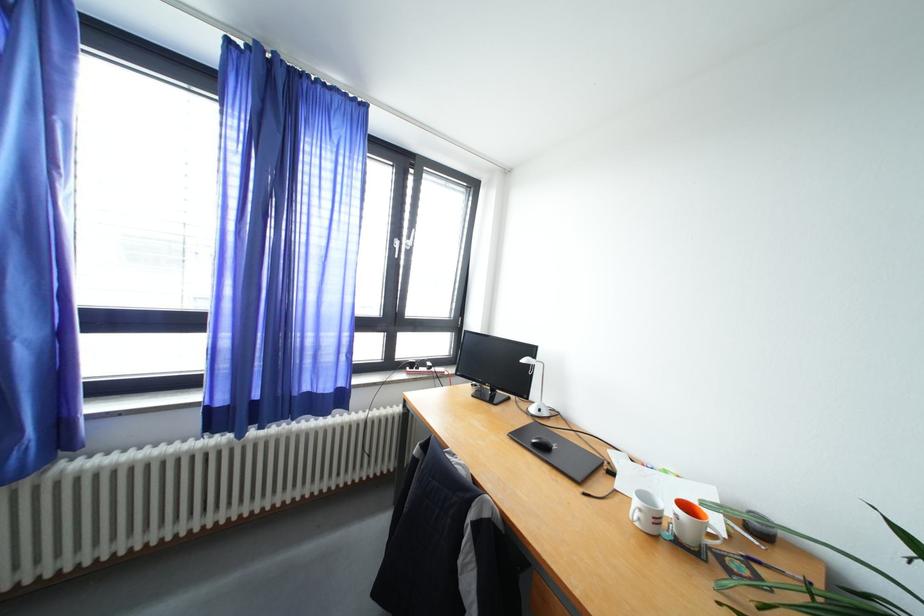
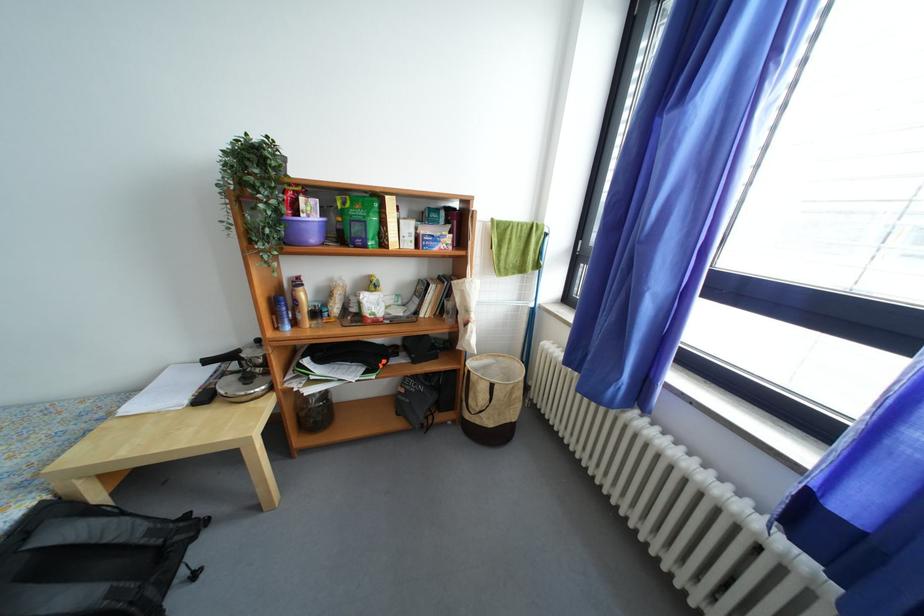
The first image is from the beginning of the video and the second image is from the end. How did the camera likely rotate when shooting the video?

The rotation direction of the camera is left-down.